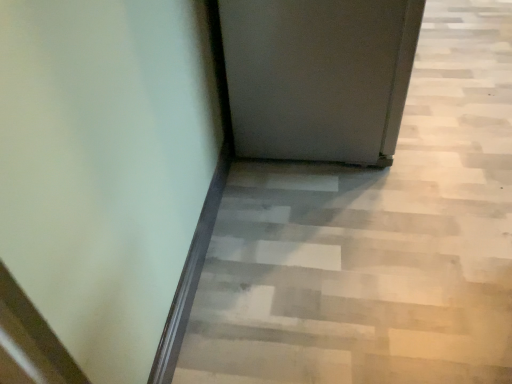
The height and width of the screenshot is (384, 512). Describe the element at coordinates (318, 76) in the screenshot. I see `satin gray door at center` at that location.

Measure the distance between satin gray door at center and camera.

satin gray door at center and camera are 4.40 feet apart.

This screenshot has height=384, width=512. I want to click on satin gray door at center, so click(318, 76).

What are the coordinates of `satin gray door at center` in the screenshot? It's located at (318, 76).